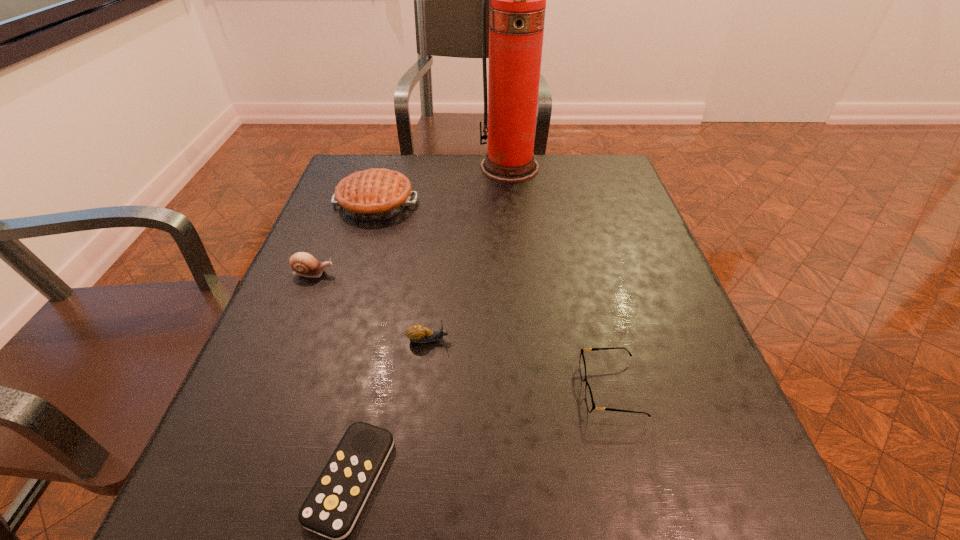
In order to click on unoccupied area between the second tallest object and the rightmost object in this screenshot , I will do `click(493, 296)`.

Find the location of a particular element. free space between the second farthest object and the left escargot is located at coordinates (345, 238).

I want to click on vacant space that is in between the rightmost object and the fourth nearest object, so click(x=463, y=331).

This screenshot has height=540, width=960. What are the coordinates of `vacant space that's between the fourth nearest object and the right escargot` in the screenshot? It's located at (372, 306).

In order to click on object that is the second nearest to the fifth farthest object in this screenshot , I will do point(331,509).

Select which object is the second closest to the second object from right to left. Please provide its 2D coordinates. Your answer should be formatted as a tuple, i.e. [(x, y)], where the tuple contains the x and y coordinates of a point satisfying the conditions above.

[(304, 264)]

Where is `vacant point that satisfies the following two spatial constraints: 1. at the discharge end of the tallest object; 2. on the front-facing side of the fourth farthest object`? This screenshot has height=540, width=960. vacant point that satisfies the following two spatial constraints: 1. at the discharge end of the tallest object; 2. on the front-facing side of the fourth farthest object is located at coordinates click(526, 340).